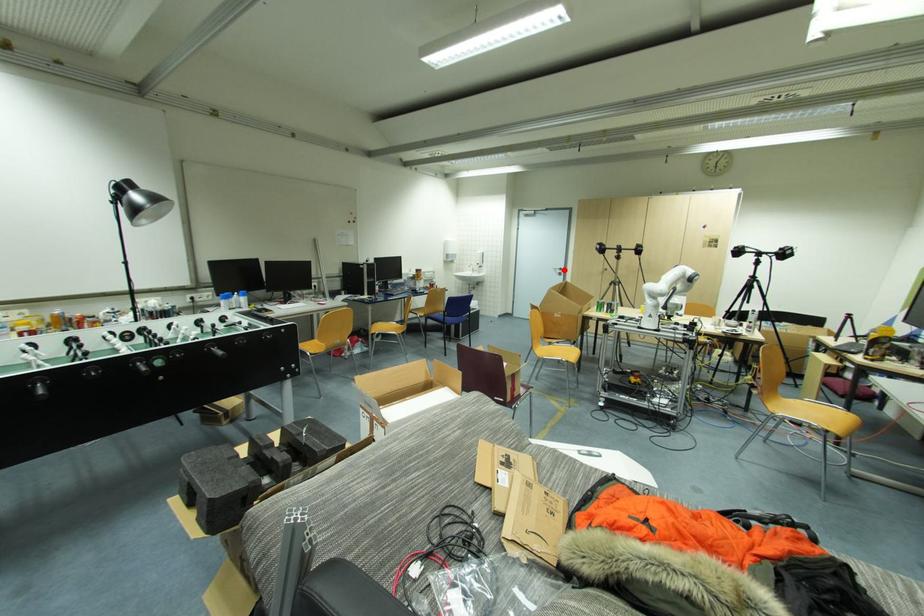
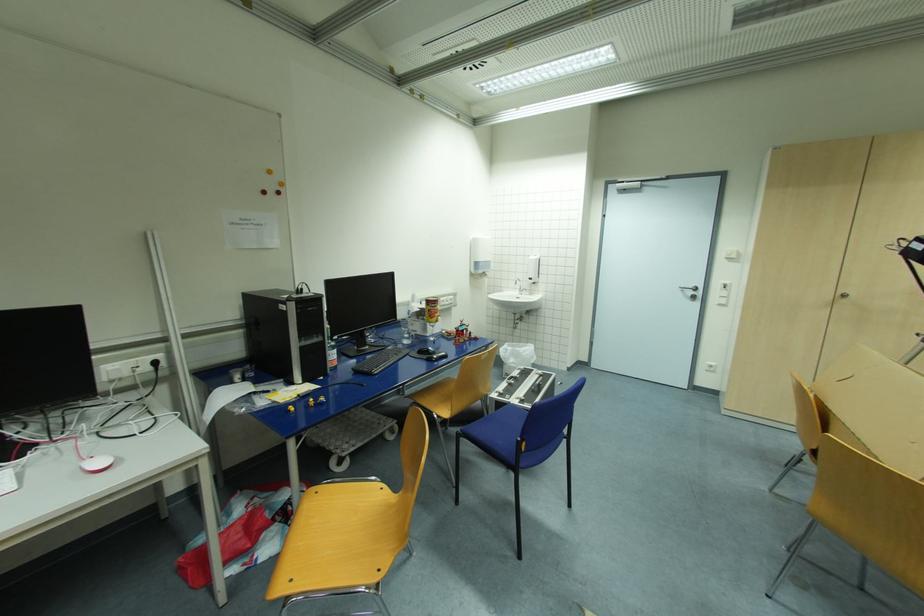
Find the pixel in the second image that matches the highlighted location in the first image.

(699, 289)